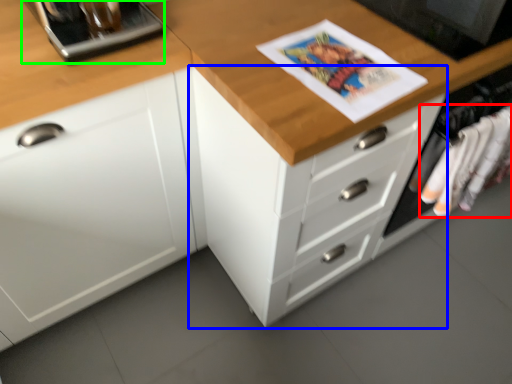
Question: Which object is the closest to the clothing (highlighted by a red box)? Choose among these: chest of drawers (highlighted by a blue box) or appliance (highlighted by a green box).

Choices:
 (A) chest of drawers
 (B) appliance

Answer: (A)